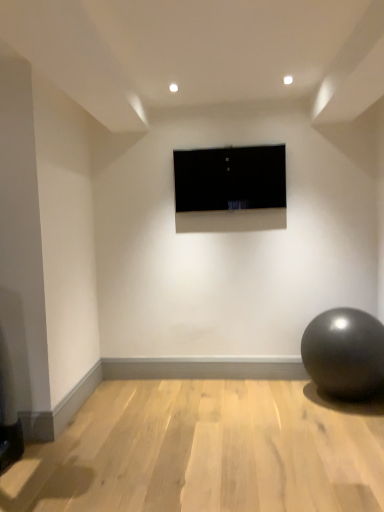
Locate an element on the screen. vacant area situated below black glossy tv at center (from a real-world perspective) is located at coordinates (244, 375).